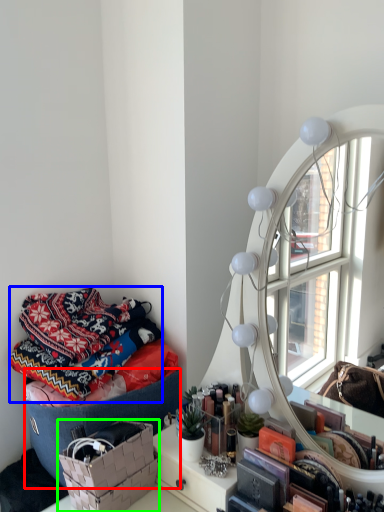
Question: Which object is positioned farthest from storage box (highlighted by a red box)? Select from blanket (highlighted by a blue box) and basket (highlighted by a green box).

Choices:
 (A) blanket
 (B) basket

Answer: (A)